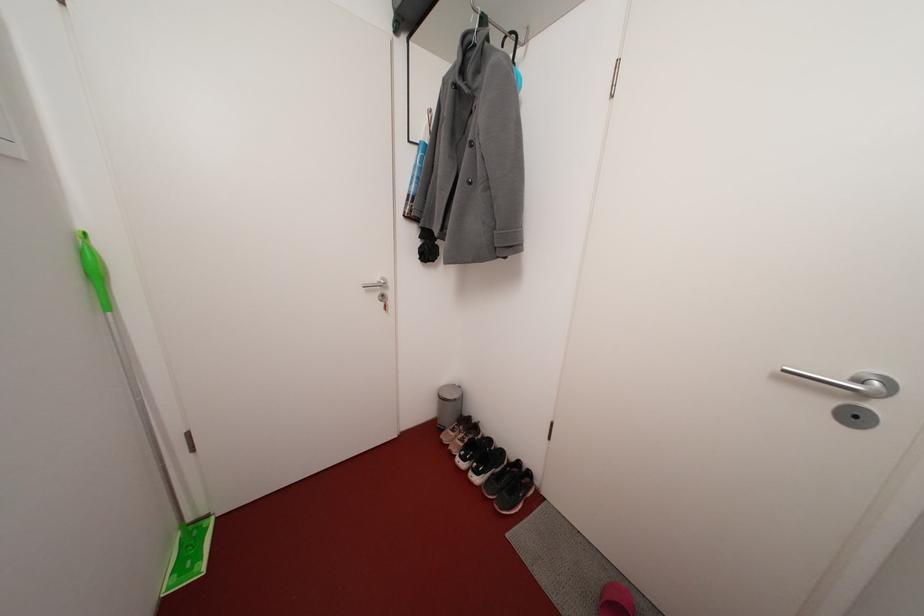
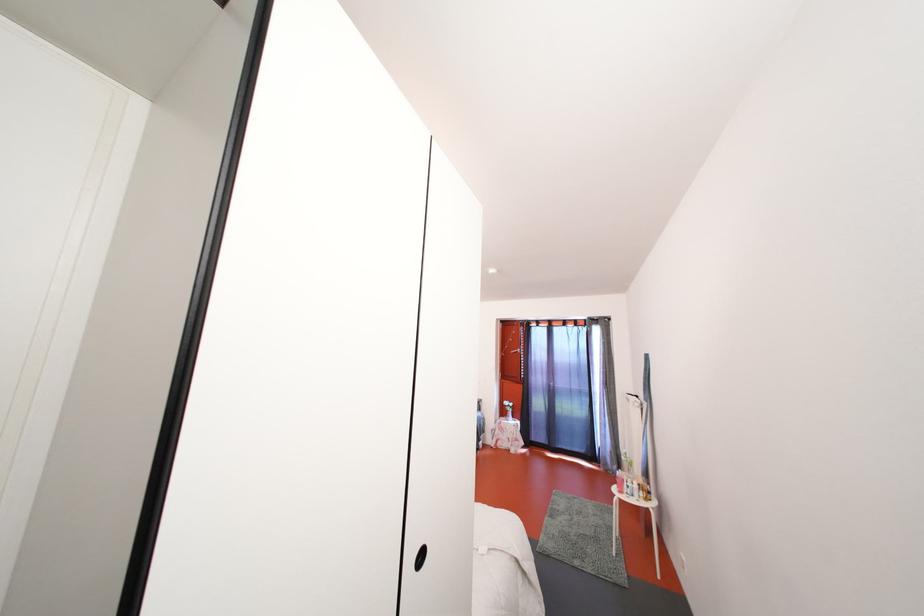
Question: The camera is either moving clockwise (left) or counter-clockwise (right) around the object. The first image is from the beginning of the video and the second image is from the end. Is the camera moving left or right when shooting the video?

Choices:
 (A) Left
 (B) Right

Answer: (A)